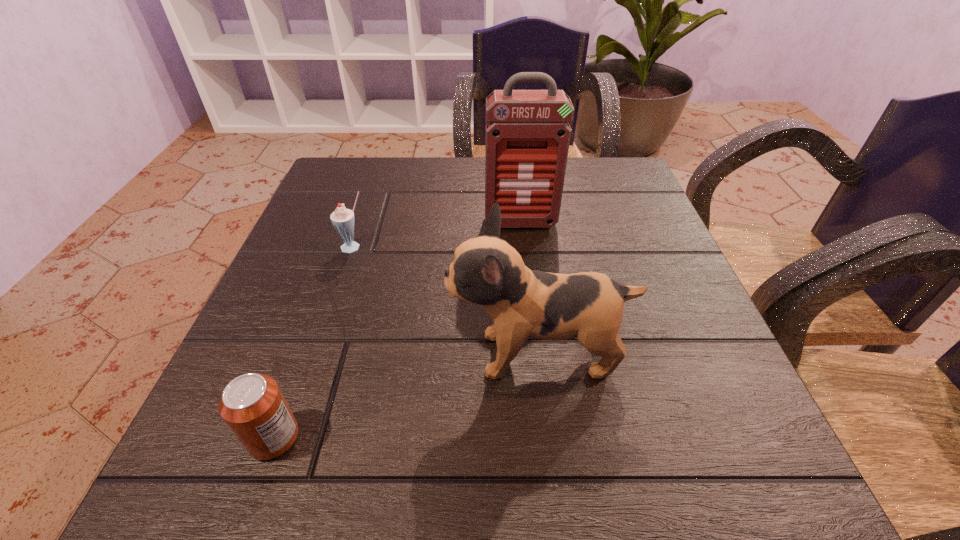
At what (x,y) coordinates should I click in order to perform the action: click on empty space that is in between the second farthest object and the farthest object. Please return your answer as a coordinate pair (x, y). Looking at the image, I should click on (437, 235).

Select which object is the closest to the can. Please provide its 2D coordinates. Your answer should be formatted as a tuple, i.e. [(x, y)], where the tuple contains the x and y coordinates of a point satisfying the conditions above.

[(487, 271)]

Locate which object is the second closest to the farthest object. Please provide its 2D coordinates. Your answer should be formatted as a tuple, i.e. [(x, y)], where the tuple contains the x and y coordinates of a point satisfying the conditions above.

[(487, 271)]